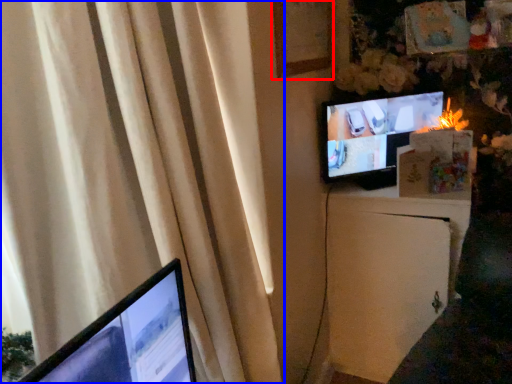
Question: Among these objects, which one is nearest to the camera, picture frame (highlighted by a red box) or curtain (highlighted by a blue box)?

Choices:
 (A) picture frame
 (B) curtain

Answer: (B)